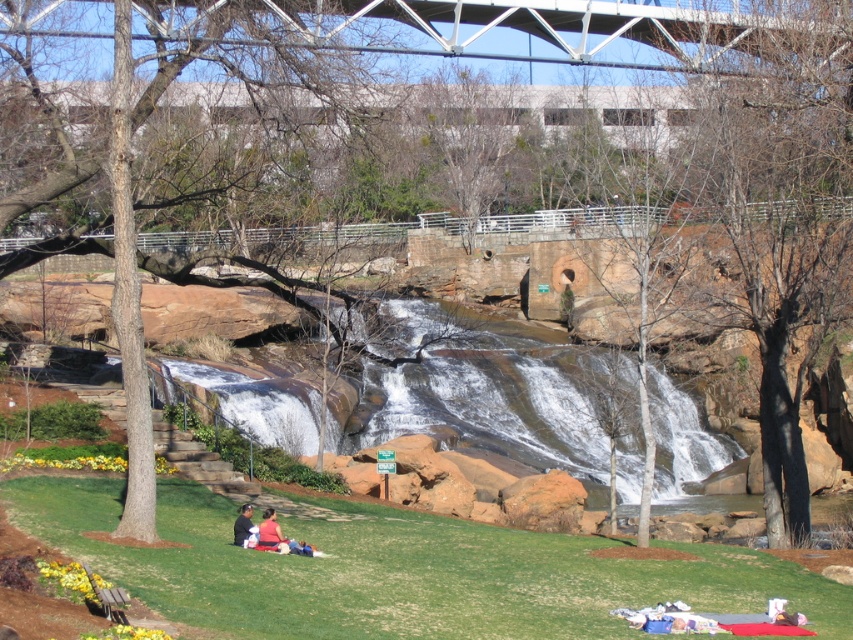
You are standing in the scene and want to place your dark brown leather jacket at lower center on the grass. However, you notice there is clear water at center nearby. Which direction should you move to avoid placing it in the water?

The clear water at center is to the right of the dark brown leather jacket at lower center. To avoid placing the jacket in the water, move it to the left where there is dry grass.

You are standing at the lower center of the image and notice a point marked at coordinates [399,572]. Based on the scene description, what is the location of this point relative to the green grass at lower center?

The point at coordinates [399,572] corresponds to the green grass at lower center, so it is located exactly on it.

You are planning to set up a picnic area in the scene. You have a picnic blanket that is the same size as the dark brown leather jacket at lower center. Can the blanket fit entirely on the green grass at lower center?

The green grass at lower center is bigger than the dark brown leather jacket at lower center, so the picnic blanket can fit entirely on the green grass at lower center since the grass area is larger than the jacket.